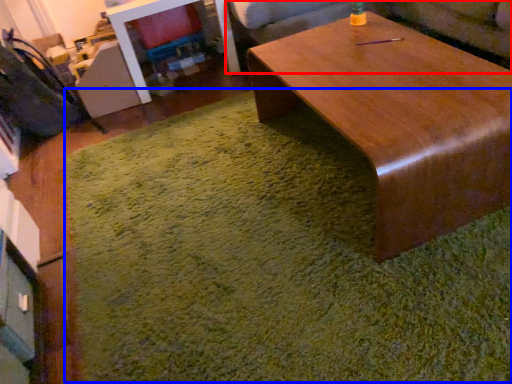
Question: Which point is closer to the camera, couch (highlighted by a red box) or mat (highlighted by a blue box)?

Choices:
 (A) couch
 (B) mat

Answer: (B)